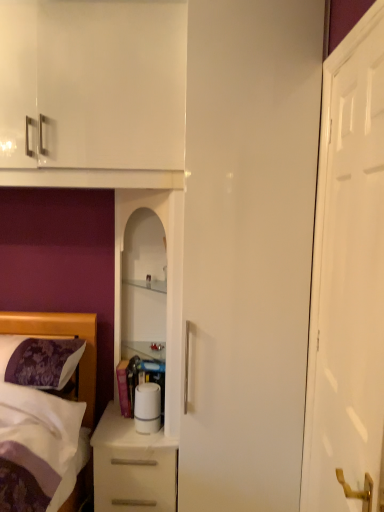
Question: Considering the relative sizes of white matte chest of drawers at lower left and white glossy cabinet at center in the image provided, is white matte chest of drawers at lower left thinner than white glossy cabinet at center?

Choices:
 (A) yes
 (B) no

Answer: (B)

Question: Is white matte chest of drawers at lower left positioned in front of white glossy cabinet at center?

Choices:
 (A) yes
 (B) no

Answer: (B)

Question: Would you say white matte chest of drawers at lower left is outside white glossy cabinet at center?

Choices:
 (A) yes
 (B) no

Answer: (A)

Question: Is the position of white matte chest of drawers at lower left more distant than that of white glossy cabinet at center?

Choices:
 (A) no
 (B) yes

Answer: (B)

Question: Is white matte chest of drawers at lower left turned away from white glossy cabinet at center?

Choices:
 (A) yes
 (B) no

Answer: (B)

Question: Could white glossy cabinet at center be considered to be inside white matte chest of drawers at lower left?

Choices:
 (A) no
 (B) yes

Answer: (A)

Question: Is white glossy cabinet at center positioned behind white matte chest of drawers at lower left?

Choices:
 (A) no
 (B) yes

Answer: (A)

Question: Does white glossy cabinet at center have a larger size compared to white matte chest of drawers at lower left?

Choices:
 (A) yes
 (B) no

Answer: (A)

Question: Is white glossy cabinet at center not inside white matte chest of drawers at lower left?

Choices:
 (A) no
 (B) yes

Answer: (B)

Question: Is white glossy cabinet at center at the left side of white matte chest of drawers at lower left?

Choices:
 (A) yes
 (B) no

Answer: (B)

Question: Is white glossy cabinet at center turned away from white matte chest of drawers at lower left?

Choices:
 (A) no
 (B) yes

Answer: (A)

Question: Is white glossy cabinet at center smaller than white matte chest of drawers at lower left?

Choices:
 (A) no
 (B) yes

Answer: (A)

Question: Is white glossy cabinet at center oriented away from white glossy door at right?

Choices:
 (A) no
 (B) yes

Answer: (A)